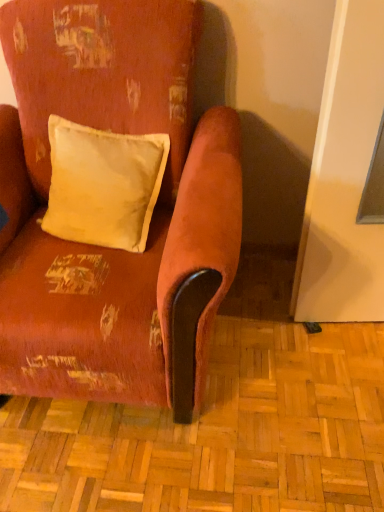
Locate an element on the screen. vacant area that is situated to the right of distressed velvet armchair at center is located at coordinates (292, 354).